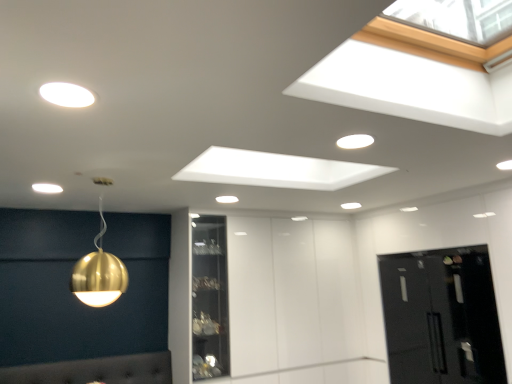
Question: Is there a large distance between matte white light fixture at upper left, acting as the 1th lamp starting from the top, and gold metallic sphere at upper left, the 2th lamp when ordered from left to right?

Choices:
 (A) no
 (B) yes

Answer: (B)

Question: From a real-world perspective, is matte white light fixture at upper left, acting as the 1th lamp starting from the top, positioned under gold metallic sphere at upper left, the fourth lamp when ordered from back to front, based on gravity?

Choices:
 (A) no
 (B) yes

Answer: (A)

Question: Considering the relative sizes of matte white light fixture at upper left, which is the 1th lamp from front to back, and gold metallic sphere at upper left, the fourth lamp when ordered from back to front, in the image provided, is matte white light fixture at upper left, which is the 1th lamp from front to back, taller than gold metallic sphere at upper left, the fourth lamp when ordered from back to front,?

Choices:
 (A) no
 (B) yes

Answer: (A)

Question: Can you confirm if matte white light fixture at upper left, which is the 5th lamp from back to front, is positioned to the right of gold metallic sphere at upper left, which is counted as the 4th lamp, starting from the right?

Choices:
 (A) yes
 (B) no

Answer: (A)

Question: Is matte white light fixture at upper left, which ranks as the third lamp in right-to-left order, at the left side of gold metallic sphere at upper left, acting as the 2th lamp starting from the front?

Choices:
 (A) no
 (B) yes

Answer: (A)

Question: From a real-world perspective, is matte gold sphere at upper center, which ranks as the 3th lamp in top-to-bottom order, above or below matte white light fixture at upper left, which ranks as the third lamp in right-to-left order?

Choices:
 (A) below
 (B) above

Answer: (A)

Question: Considering the positions of matte gold sphere at upper center, positioned as the fourth lamp in left-to-right order, and matte white light fixture at upper left, the fifth lamp from the bottom, in the image, is matte gold sphere at upper center, positioned as the fourth lamp in left-to-right order, bigger or smaller than matte white light fixture at upper left, the fifth lamp from the bottom,?

Choices:
 (A) big
 (B) small

Answer: (B)

Question: Visually, is matte gold sphere at upper center, positioned as the third lamp in bottom-to-top order, positioned to the left or to the right of matte white light fixture at upper left, the 3th lamp viewed from the left?

Choices:
 (A) right
 (B) left

Answer: (A)

Question: In terms of width, does matte gold sphere at upper center, which ranks as the 3th lamp in top-to-bottom order, look wider or thinner when compared to matte white light fixture at upper left, the 3th lamp viewed from the left?

Choices:
 (A) wide
 (B) thin

Answer: (A)

Question: Is matte gold sphere at upper left, the second lamp viewed from the top, spatially inside gold metallic sphere at upper left, the 2th lamp when ordered from left to right, or outside of it?

Choices:
 (A) inside
 (B) outside

Answer: (B)

Question: Would you say matte gold sphere at upper left, which is counted as the fourth lamp, starting from the bottom, is to the left or to the right of gold metallic sphere at upper left, the first lamp when ordered from bottom to top, in the picture?

Choices:
 (A) left
 (B) right

Answer: (A)

Question: From the image's perspective, is matte gold sphere at upper left, the 3th lamp when ordered from front to back, positioned above or below gold metallic sphere at upper left, the first lamp when ordered from bottom to top?

Choices:
 (A) below
 (B) above

Answer: (B)

Question: Is matte gold sphere at upper left, the 3th lamp when ordered from back to front, bigger or smaller than gold metallic sphere at upper left, the first lamp when ordered from bottom to top?

Choices:
 (A) big
 (B) small

Answer: (B)

Question: From the image's perspective, is black glass door at lower right above or below gold metallic sphere at upper left, the first lamp when ordered from bottom to top?

Choices:
 (A) above
 (B) below

Answer: (B)

Question: Which is correct: black glass door at lower right is inside gold metallic sphere at upper left, the 2th lamp when ordered from left to right, or outside of it?

Choices:
 (A) inside
 (B) outside

Answer: (B)